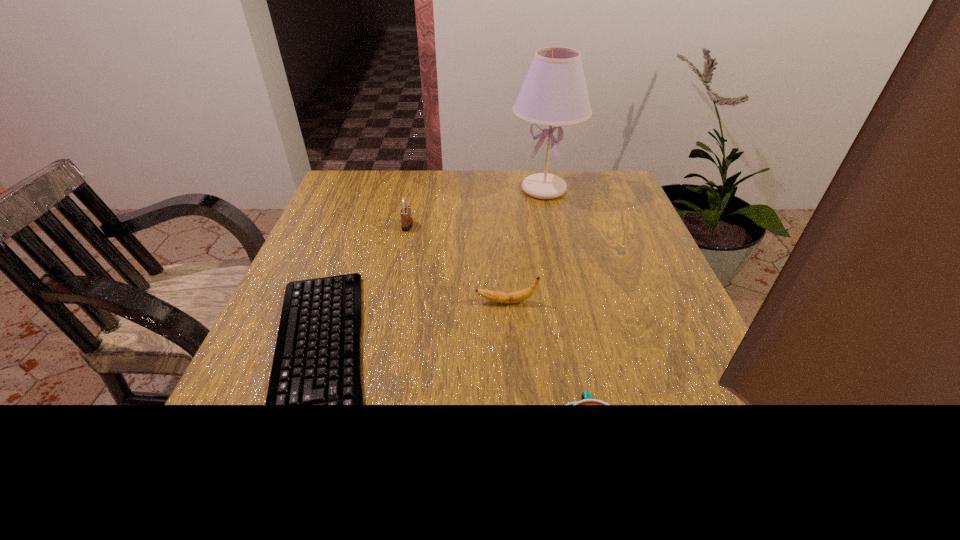
At what (x,y) coordinates should I click in order to perform the action: click on object that is at the right edge. Please return your answer as a coordinate pair (x, y). Looking at the image, I should click on (554, 92).

Identify the location of object present at the near left corner. This screenshot has height=540, width=960. (317, 360).

Image resolution: width=960 pixels, height=540 pixels. What are the coordinates of `object present at the far right corner` in the screenshot? It's located at pos(554,92).

In the image, there is a desktop. Identify the location of free space at the far edge. (471, 194).

What are the coordinates of `free region at the near edge` in the screenshot? It's located at (317, 517).

Where is `vacant region at the left edge of the desktop`? The width and height of the screenshot is (960, 540). vacant region at the left edge of the desktop is located at coordinates (246, 451).

This screenshot has height=540, width=960. Identify the location of vacant space at the right edge. (603, 220).

In the image, there is a desktop. At what (x,y) coordinates should I click in order to perform the action: click on vacant area at the far right corner. Please return your answer as a coordinate pair (x, y). The image size is (960, 540). Looking at the image, I should click on (608, 175).

This screenshot has height=540, width=960. In order to click on free space between the farthest object and the computer keyboard in this screenshot , I will do `click(431, 279)`.

Locate an element on the screen. The image size is (960, 540). vacant area that lies between the computer keyboard and the fourth nearest object is located at coordinates (363, 298).